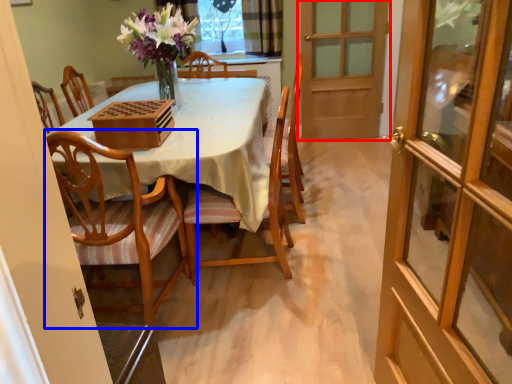
Question: Which of the following is the farthest to the observer, door (highlighted by a red box) or chair (highlighted by a blue box)?

Choices:
 (A) door
 (B) chair

Answer: (A)